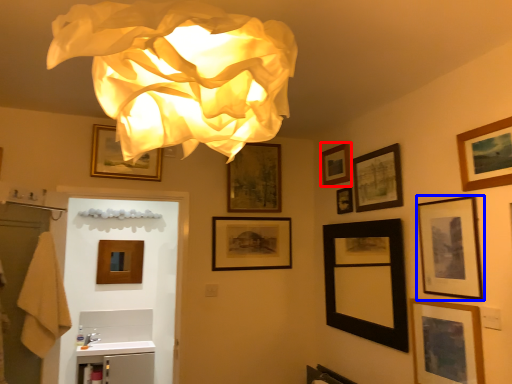
Question: Which object is further to the camera taking this photo, picture frame (highlighted by a red box) or picture frame (highlighted by a blue box)?

Choices:
 (A) picture frame
 (B) picture frame

Answer: (A)